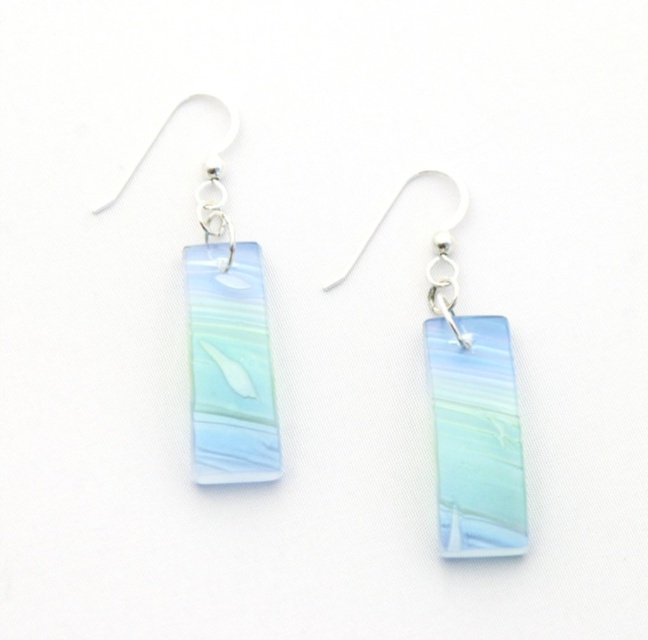
Can you confirm if translucent glass rectangle at center is taller than translucent glass rectangle at left?

No.

What do you see at coordinates (469, 406) in the screenshot? I see `translucent glass rectangle at center` at bounding box center [469, 406].

Locate an element on the screen. The width and height of the screenshot is (648, 640). translucent glass rectangle at center is located at coordinates (469, 406).

Is point (478, 513) behind point (202, 333)?

No, it is in front of (202, 333).

Can you confirm if translucent glass rectangle at center is thinner than translucent glass fish at center?

Incorrect, translucent glass rectangle at center's width is not less than translucent glass fish at center's.

At what (x,y) coordinates should I click in order to perform the action: click on translucent glass rectangle at center. Please return your answer as a coordinate pair (x, y). Looking at the image, I should click on (469, 406).

Is translucent glass rectangle at center closer to camera compared to translucent glass pendant at center?

No, translucent glass rectangle at center is behind translucent glass pendant at center.

Does point (486, 326) come in front of point (516, 448)?

No, it is not.

Is point (487, 333) farther from viewer compared to point (426, 330)?

No.

This screenshot has width=648, height=640. Identify the location of translucent glass rectangle at center. (469, 406).